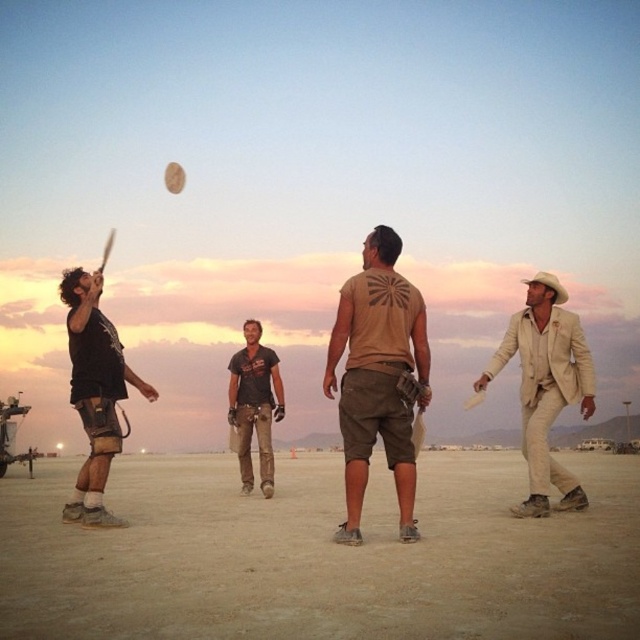
Question: Which object appears closest to the camera in this image?

Choices:
 (A) black matte t-shirt at left
 (B) tan cotton t-shirt at center
 (C) beige suit at right

Answer: (B)

Question: Is tan cotton t-shirt at center above beige suit at right?

Choices:
 (A) no
 (B) yes

Answer: (B)

Question: Can you confirm if tan cotton t-shirt at center is thinner than beige suit at right?

Choices:
 (A) no
 (B) yes

Answer: (B)

Question: Is tan cotton t-shirt at center to the left of beige suit at right from the viewer's perspective?

Choices:
 (A) no
 (B) yes

Answer: (B)

Question: Among these objects, which one is farthest from the camera?

Choices:
 (A) black matte t-shirt at left
 (B) dark brown leather pants at center

Answer: (B)

Question: Estimate the real-world distances between objects in this image. Which object is closer to the beige suit at right?

Choices:
 (A) black matte t-shirt at left
 (B) tan cotton t-shirt at center

Answer: (B)